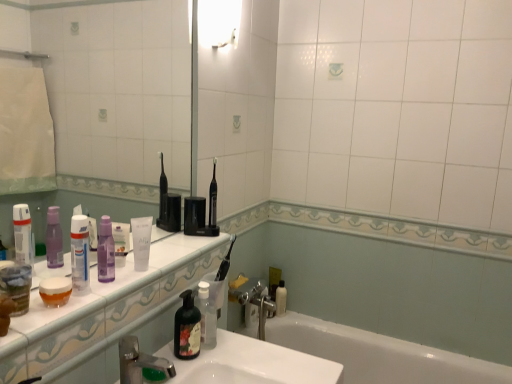
This screenshot has height=384, width=512. In order to click on spots to the right of transparent plastic bottle at left, which is the 5th toiletry in back-to-front order in this screenshot , I will do `click(113, 291)`.